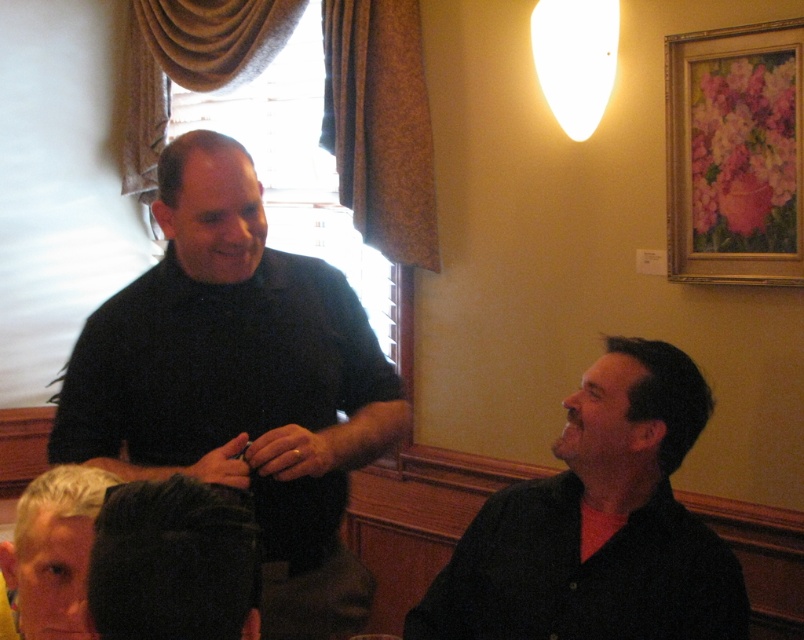
Question: Is gold-framed floral painting at upper right below dark hair at lower left?

Choices:
 (A) yes
 (B) no

Answer: (B)

Question: Can you confirm if gold-framed floral painting at upper right is positioned above dark hair at lower left?

Choices:
 (A) no
 (B) yes

Answer: (B)

Question: Which point appears closest to the camera in this image?

Choices:
 (A) (695, 616)
 (B) (109, 307)
 (C) (191, 490)
 (D) (42, 609)

Answer: (C)

Question: In this image, where is black matte shirt at upper left located relative to blonde hair at lower left?

Choices:
 (A) left
 (B) right

Answer: (B)

Question: Which of the following is the farthest from the observer?

Choices:
 (A) pyautogui.click(x=700, y=563)
 (B) pyautogui.click(x=23, y=570)

Answer: (A)

Question: Which point is farther to the camera?

Choices:
 (A) dark hair at lower left
 (B) black matte shirt at upper left
 (C) gold-framed floral painting at upper right
 (D) black matte shirt at right

Answer: (C)